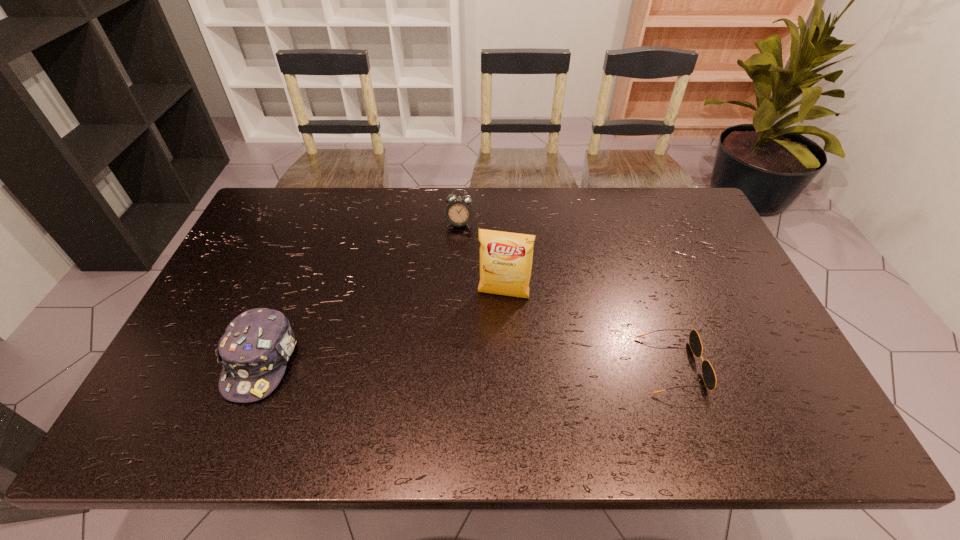
In order to click on vacant area at the left edge of the desktop in this screenshot , I will do `click(265, 282)`.

Where is `free space at the right edge of the desktop`? The image size is (960, 540). free space at the right edge of the desktop is located at coordinates (676, 242).

Where is `free region at the far right corner of the desktop`? The height and width of the screenshot is (540, 960). free region at the far right corner of the desktop is located at coordinates (703, 228).

Find the location of a particular element. The image size is (960, 540). free space between the headwear and the crisp (potato chip) is located at coordinates (382, 328).

Identify the location of vacant point located between the crisp (potato chip) and the headwear. (382, 328).

At what (x,y) coordinates should I click in order to perform the action: click on free area in between the third object from left to right and the headwear. Please return your answer as a coordinate pair (x, y). The image size is (960, 540). Looking at the image, I should click on (382, 328).

This screenshot has height=540, width=960. Find the location of `unoccupied area between the crisp (potato chip) and the rightmost object`. unoccupied area between the crisp (potato chip) and the rightmost object is located at coordinates (588, 330).

The height and width of the screenshot is (540, 960). Identify the location of vacant point located between the headwear and the second object from left to right. (361, 293).

What are the coordinates of `vacant region between the alarm clock and the sunglasses` in the screenshot? It's located at (565, 294).

Identify the location of free space between the shortest object and the headwear. (467, 363).